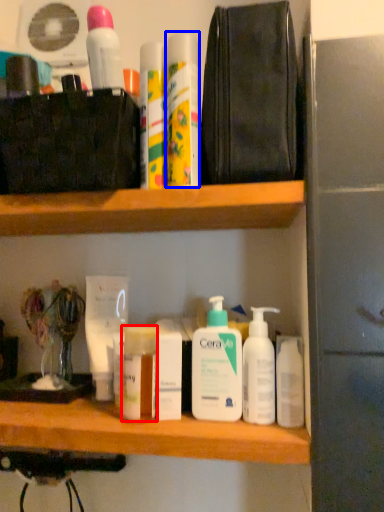
Question: Which of the following is the closest to the observer, toiletry (highlighted by a red box) or mouthwash (highlighted by a blue box)?

Choices:
 (A) toiletry
 (B) mouthwash

Answer: (B)